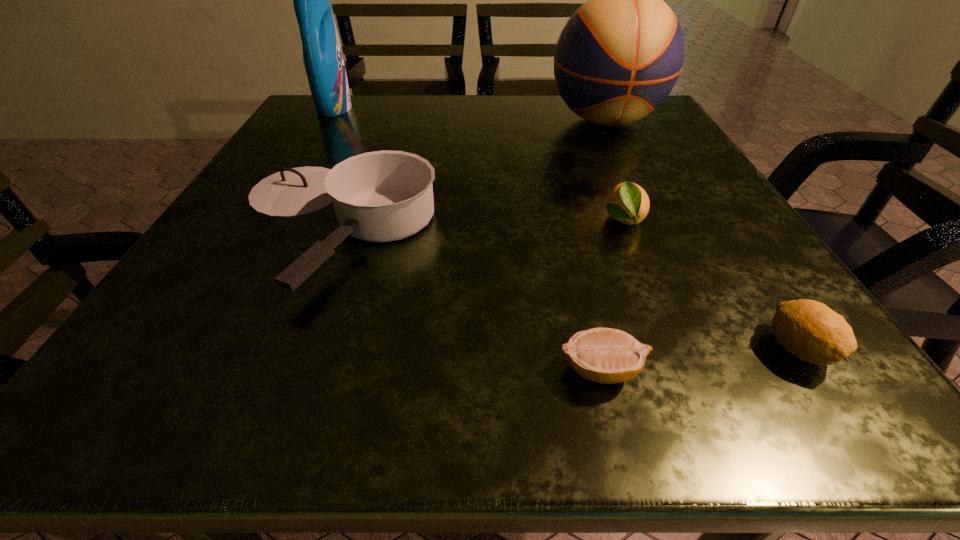
Where is `the closest lemon to the basketball`? the closest lemon to the basketball is located at coordinates (629, 204).

Image resolution: width=960 pixels, height=540 pixels. In order to click on free space in the image that satisfies the following two spatial constraints: 1. on the front-facing side of the shortest object; 2. on the left side of the detergent in this screenshot , I will do tap(178, 370).

At what (x,y) coordinates should I click in order to perform the action: click on free location that satisfies the following two spatial constraints: 1. on the back side of the shortest object; 2. on the front-facing side of the detergent. Please return your answer as a coordinate pair (x, y). Looking at the image, I should click on (539, 107).